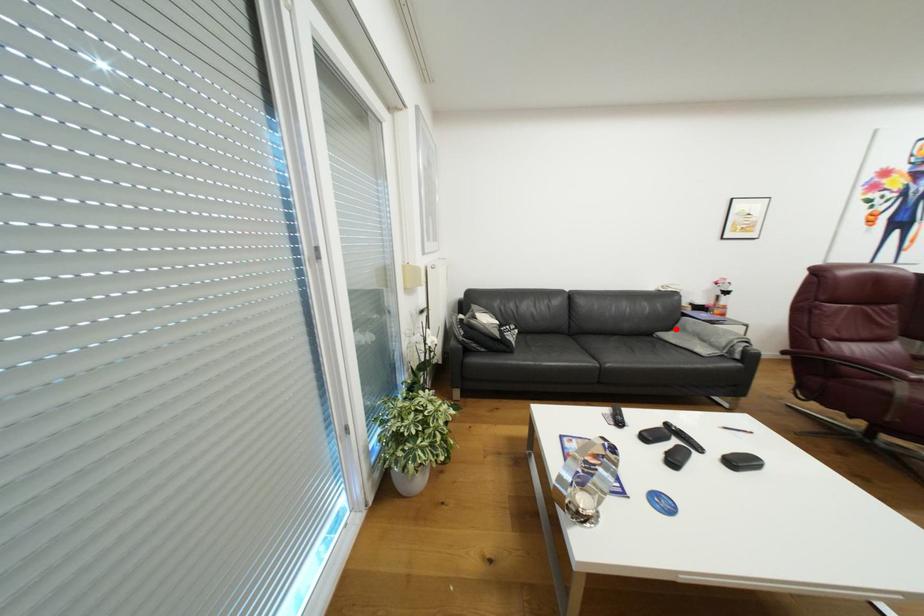
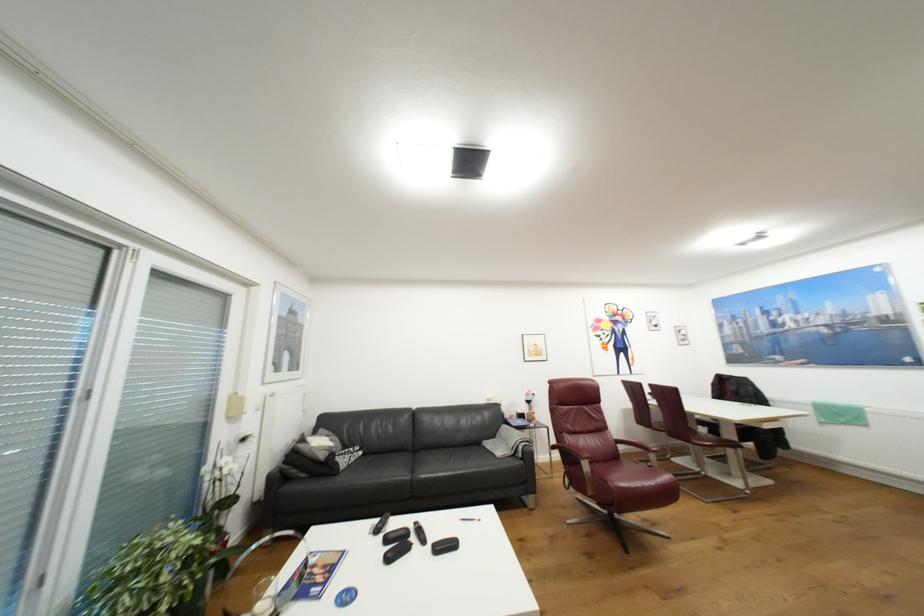
In the second image, find the point that corresponds to the highlighted location in the first image.

(500, 437)